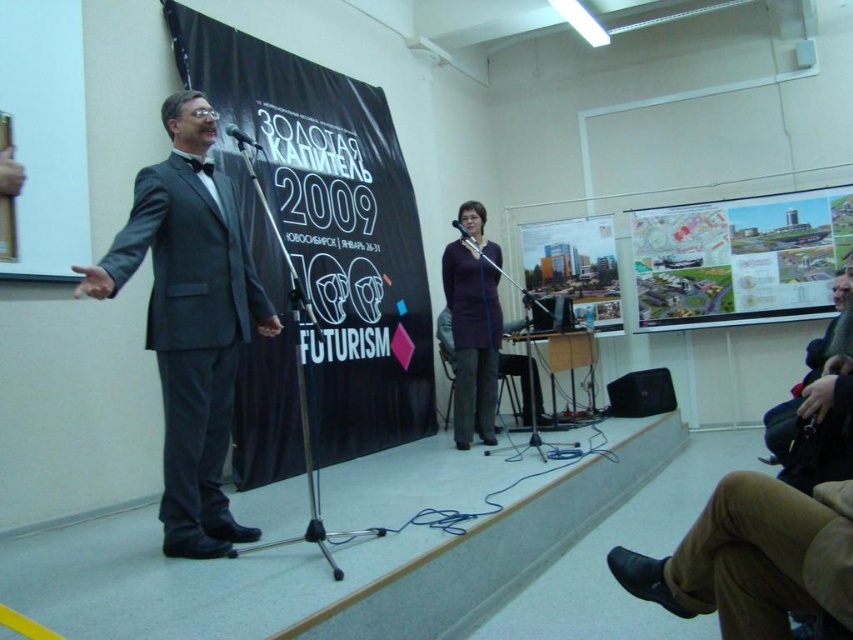
You are an event organizer who needs to ensure that all participants can see the presentation clearly. Considering the matte gray suit at left and the matte paper map at upper right, which object has a narrower width when viewed from the front?

The matte gray suit at left is thinner than the matte paper map at upper right, so the matte gray suit at left has a narrower width when viewed from the front.

What object is located at the coordinates point (573, 266) in the scene?

The matte glass building at center is located at point (573, 266).

You are a photographer positioned at the back of the room. You want to take a photo that includes both the purple fabric dress at center and the matte glass building at center. Given that your camera has a maximum focus range of 7 feet, will you be able to capture both subjects in focus?

The purple fabric dress at center is 7.02 feet away from the matte glass building at center. Since the distance between them is slightly over 7 feet, your camera might struggle to keep both in focus simultaneously. Consider adjusting your position or using a different lens to ensure clarity for both subjects.